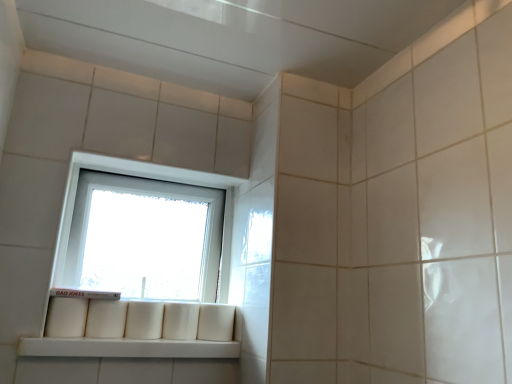
Question: Considering their positions, is white matte window sill at lower left located in front of or behind white plastic window at center?

Choices:
 (A) front
 (B) behind

Answer: (A)

Question: Does point (140, 342) appear closer or farther from the camera than point (208, 192)?

Choices:
 (A) farther
 (B) closer

Answer: (B)

Question: Based on their positions, is white matte window sill at lower left located to the left or right of white plastic window at center?

Choices:
 (A) left
 (B) right

Answer: (A)

Question: From the image's perspective, is white plastic window at center above or below white matte window sill at lower left?

Choices:
 (A) above
 (B) below

Answer: (A)

Question: Does point (217, 228) appear closer or farther from the camera than point (210, 344)?

Choices:
 (A) farther
 (B) closer

Answer: (A)

Question: Considering the relative positions of white plastic window at center and white matte window sill at lower left in the image provided, is white plastic window at center to the left or to the right of white matte window sill at lower left?

Choices:
 (A) right
 (B) left

Answer: (A)

Question: In the image, is white plastic window at center positioned in front of or behind white matte window sill at lower left?

Choices:
 (A) front
 (B) behind

Answer: (B)